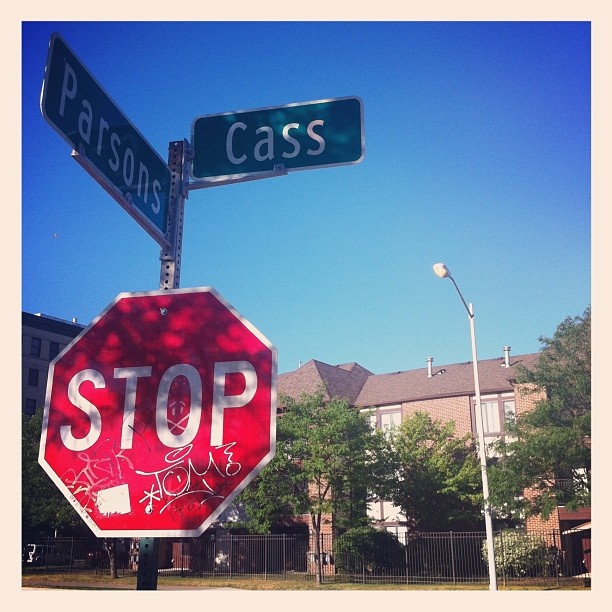
Locate an element on the screen. Image resolution: width=612 pixels, height=612 pixels. lamp is located at coordinates (442, 272).